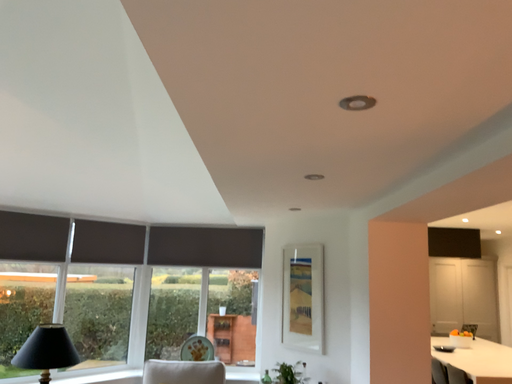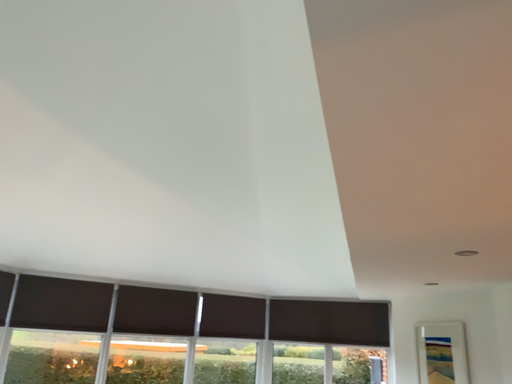
Question: How did the camera likely rotate when shooting the video?

Choices:
 (A) rotated upward
 (B) rotated downward

Answer: (A)